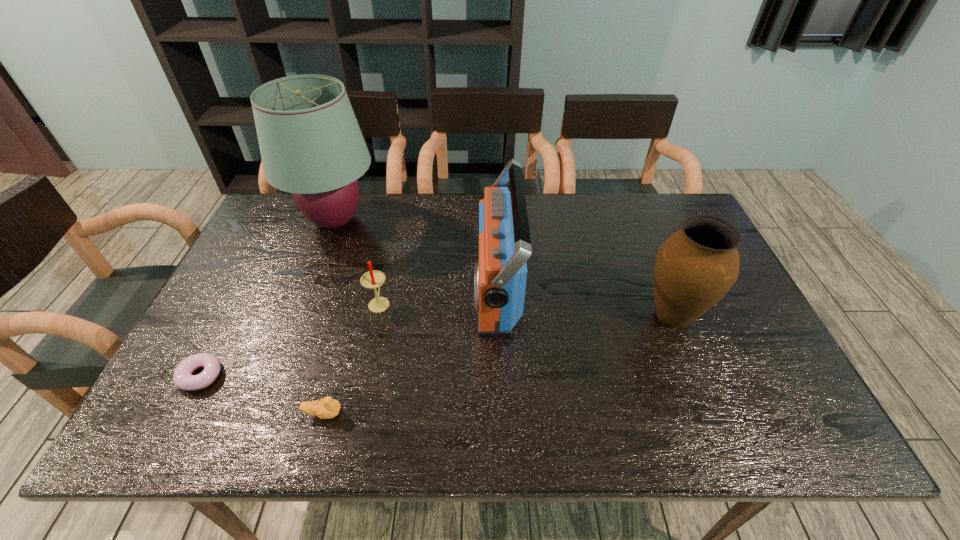
Locate an element on the screen. free location located on the front-facing side of the radio receiver is located at coordinates (401, 289).

Image resolution: width=960 pixels, height=540 pixels. In order to click on free space located 0.060m on the front-facing side of the radio receiver in this screenshot , I will do `click(452, 289)`.

Find the location of a particular element. The width and height of the screenshot is (960, 540). free space located 0.270m on the back of the rightmost object is located at coordinates (638, 230).

This screenshot has width=960, height=540. I want to click on free space located 0.180m on the back of the candle, so click(x=391, y=248).

I want to click on vacant space situated 0.280m on the face of the nearest object, so click(x=472, y=414).

Find the location of a particular element. This screenshot has width=960, height=540. free space located 0.060m on the right of the doughnut is located at coordinates (249, 376).

The height and width of the screenshot is (540, 960). Identify the location of object that is at the far edge. (311, 145).

Find the location of a particular element. object at the near edge is located at coordinates (326, 408).

Identify the location of lampshade that is positioned at the left edge. (311, 145).

In order to click on doughnut that is at the left edge in this screenshot , I will do `click(183, 379)`.